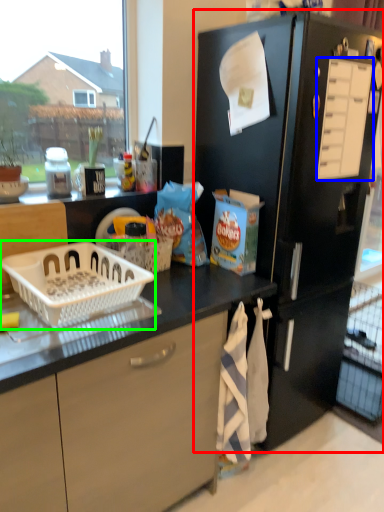
Question: Considering the real-world distances, which object is closest to refrigerator (highlighted by a red box)? drawer (highlighted by a blue box) or basket (highlighted by a green box).

Choices:
 (A) drawer
 (B) basket

Answer: (A)